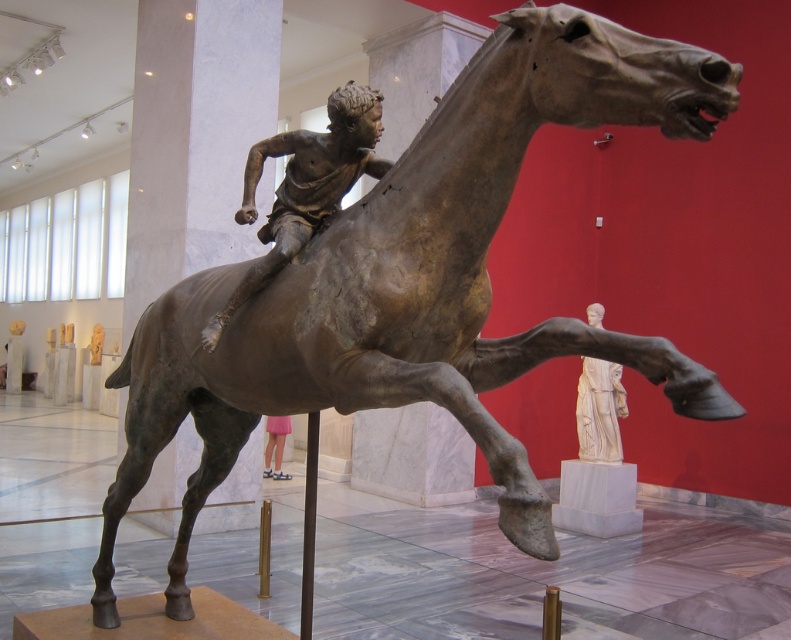
Consider the image. Does bronze figure at center have a greater width compared to white marble statue at right?

Correct, the width of bronze figure at center exceeds that of white marble statue at right.

Which is behind, point (233, 308) or point (614, 436)?

The point (614, 436) is more distant.

Where is `bronze figure at center`? bronze figure at center is located at coordinates (305, 186).

Locate an element on the screen. The height and width of the screenshot is (640, 791). bronze figure at center is located at coordinates (305, 186).

Who is higher up, bronze figure at center or pink fabric skirt at lower center?

Positioned higher is bronze figure at center.

Does bronze figure at center appear on the right side of pink fabric skirt at lower center?

Yes, bronze figure at center is to the right of pink fabric skirt at lower center.

This screenshot has width=791, height=640. Identify the location of bronze figure at center. (305, 186).

Between white marble statue at right and pink fabric skirt at lower center, which one appears on the right side from the viewer's perspective?

white marble statue at right

What do you see at coordinates (600, 410) in the screenshot? I see `white marble statue at right` at bounding box center [600, 410].

The height and width of the screenshot is (640, 791). Find the location of `white marble statue at right`. white marble statue at right is located at coordinates (600, 410).